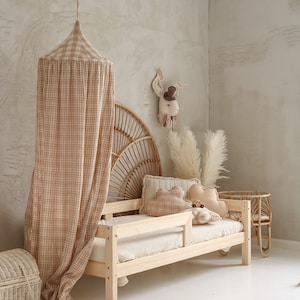
The image size is (300, 300). I want to click on mattress, so click(x=200, y=231).